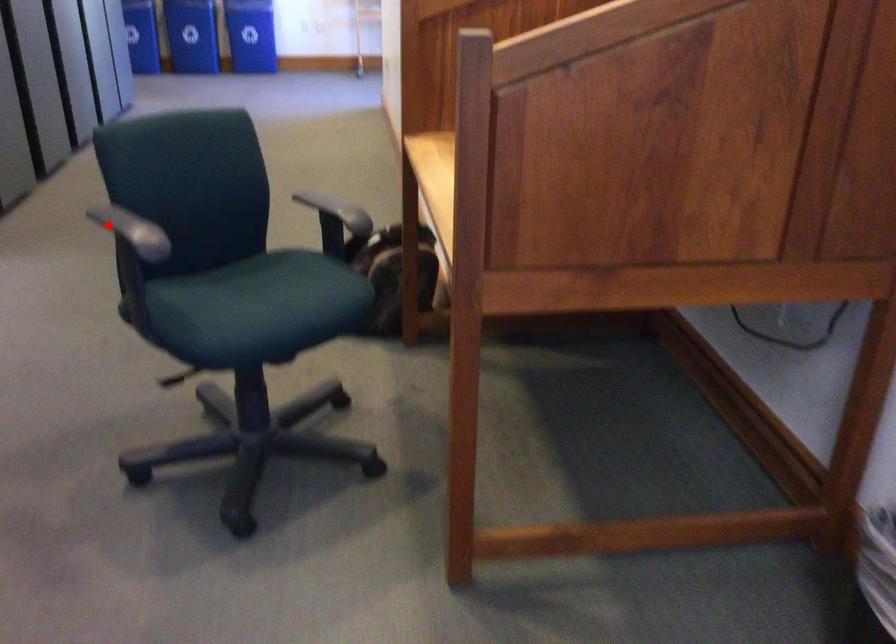
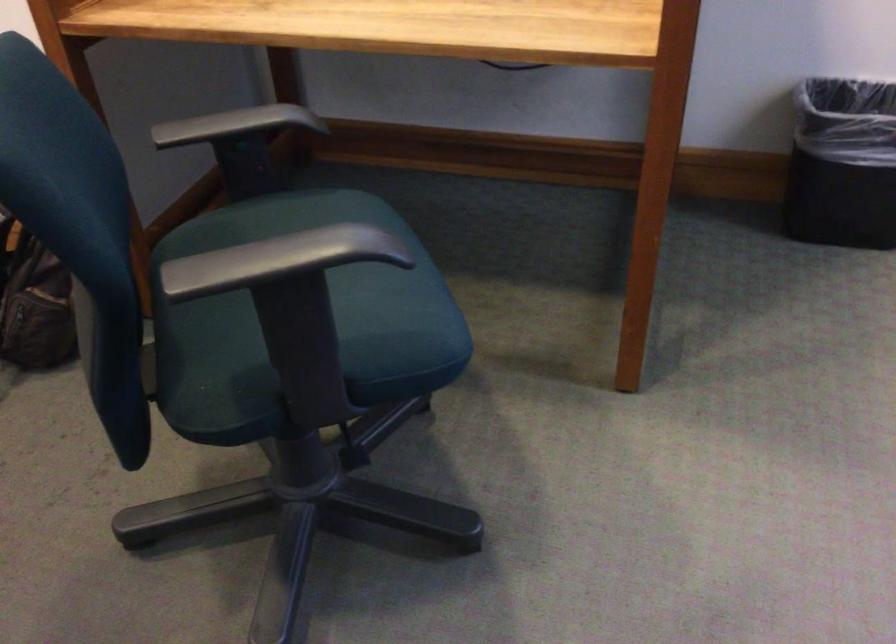
Question: A red point is marked in image1. In image2, is the corresponding 3D point closer to the camera or farther? Reply with the corresponding letter.

Choices:
 (A) The corresponding 3D point is closer.
 (B) The corresponding 3D point is farther.

Answer: (A)